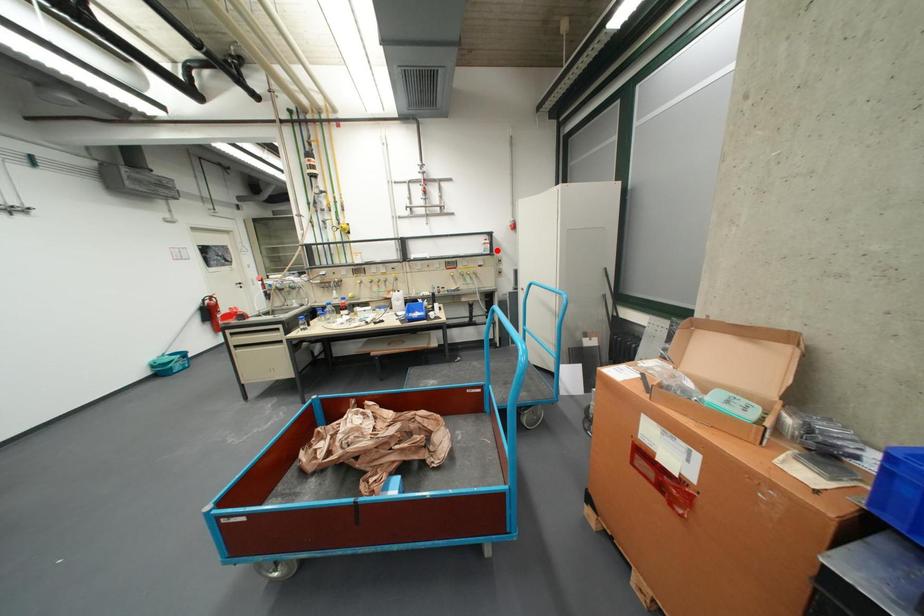
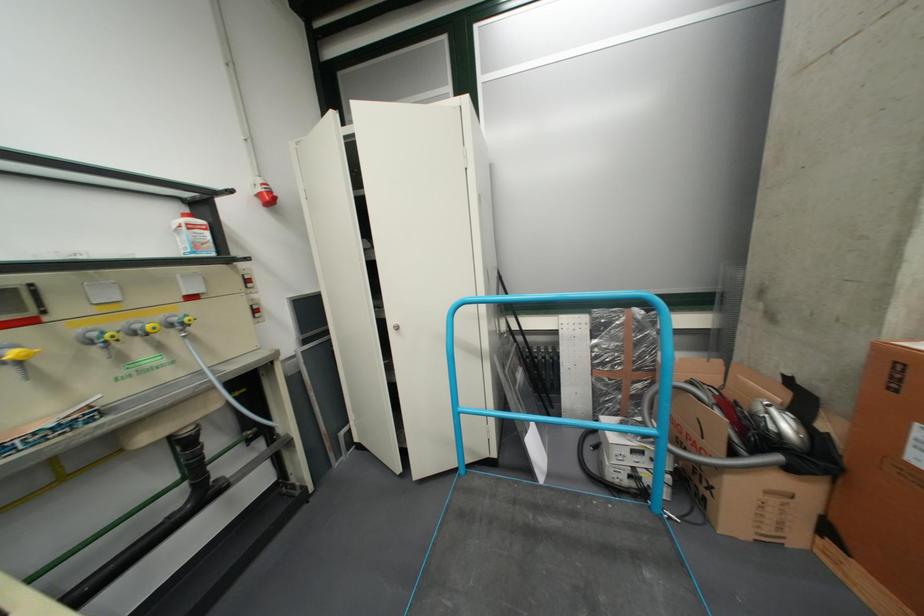
Find the pixel in the second image that matches the highlighted location in the first image.

(208, 246)